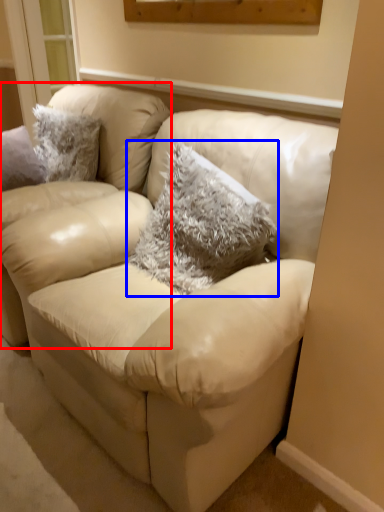
Question: Which object is closer to the camera taking this photo, chair (highlighted by a red box) or throw pillow (highlighted by a blue box)?

Choices:
 (A) chair
 (B) throw pillow

Answer: (B)